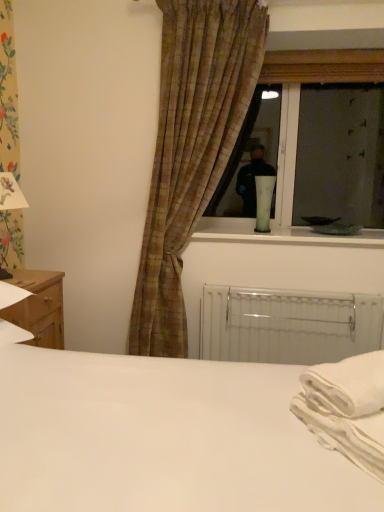
The height and width of the screenshot is (512, 384). Find the location of `vacant region in front of green glass vase at window, marked as the 1th table lamp in a back-to-front arrangement`. vacant region in front of green glass vase at window, marked as the 1th table lamp in a back-to-front arrangement is located at coordinates (265, 237).